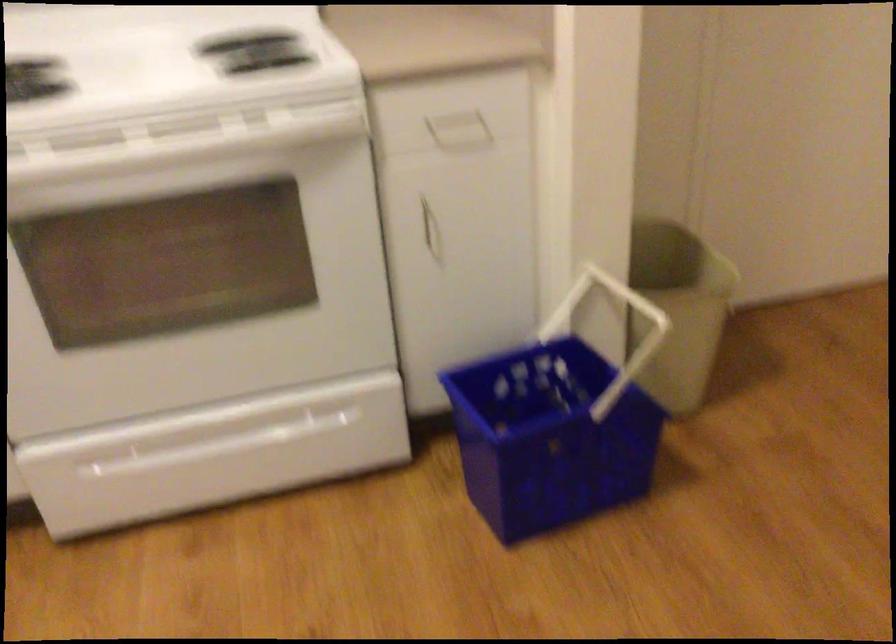
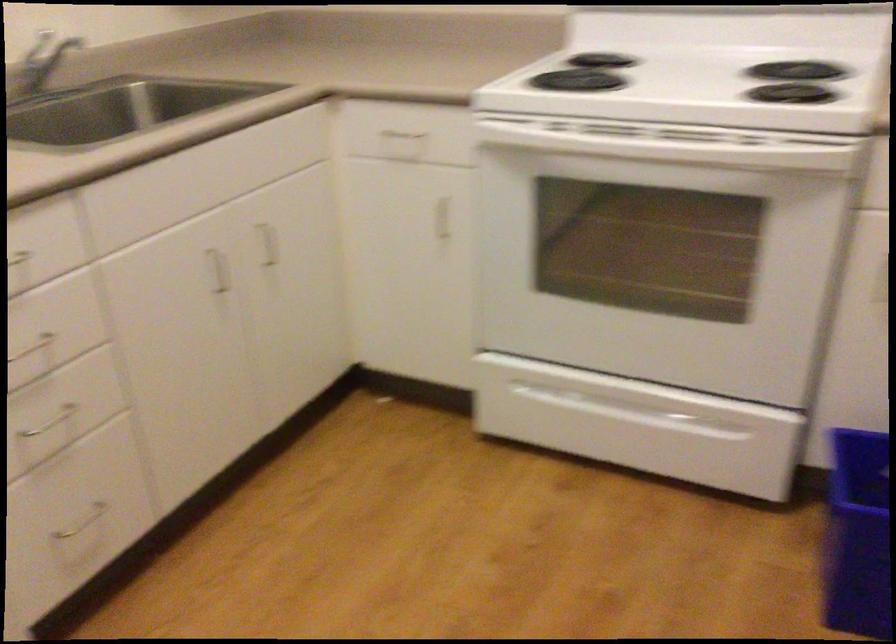
Question: The camera is either moving clockwise (left) or counter-clockwise (right) around the object. The first image is from the beginning of the video and the second image is from the end. Is the camera moving left or right when shooting the video?

Choices:
 (A) Left
 (B) Right

Answer: (B)